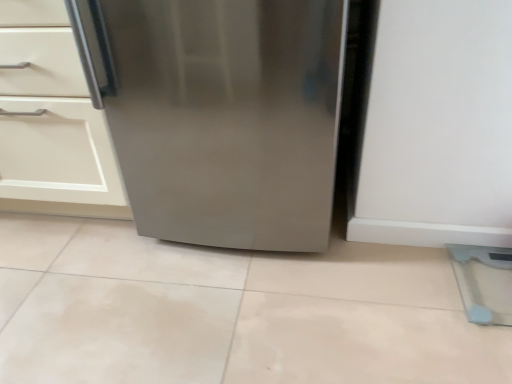
Question: Considering the positions of stainless steel refrigerator at center and matte white cabinet at left in the image, is stainless steel refrigerator at center bigger or smaller than matte white cabinet at left?

Choices:
 (A) small
 (B) big

Answer: (A)

Question: Is point (473, 122) positioned closer to the camera than point (31, 97)?

Choices:
 (A) closer
 (B) farther

Answer: (A)

Question: From the image's perspective, relative to matte white cabinet at left, is stainless steel refrigerator at center above or below?

Choices:
 (A) below
 (B) above

Answer: (A)

Question: Is matte white cabinet at left bigger or smaller than stainless steel refrigerator at center?

Choices:
 (A) big
 (B) small

Answer: (A)

Question: From a real-world perspective, is matte white cabinet at left physically located above or below stainless steel refrigerator at center?

Choices:
 (A) above
 (B) below

Answer: (B)

Question: Does point (74, 210) appear closer or farther from the camera than point (207, 155)?

Choices:
 (A) farther
 (B) closer

Answer: (A)

Question: From their relative heights in the image, would you say matte white cabinet at left is taller or shorter than stainless steel refrigerator at center?

Choices:
 (A) short
 (B) tall

Answer: (A)